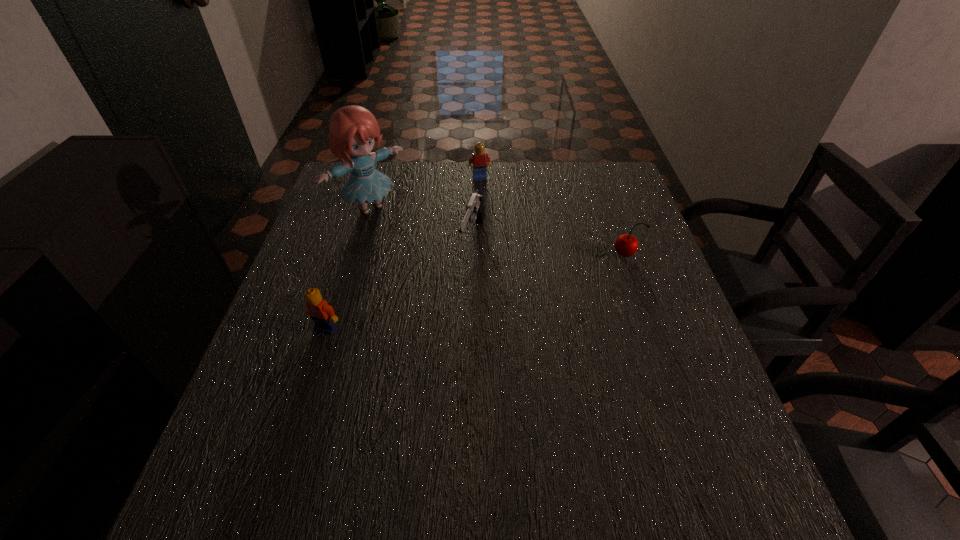
Find the location of a particular element. the nearer Lego is located at coordinates tap(323, 315).

Image resolution: width=960 pixels, height=540 pixels. Identify the location of the left Lego. (323, 315).

Where is `the rightmost object`? the rightmost object is located at coordinates (626, 245).

Identify the location of the right Lego. This screenshot has width=960, height=540. (480, 160).

Locate an element on the screen. The width and height of the screenshot is (960, 540). the farther Lego is located at coordinates coord(480,160).

Identify the location of gun. (475, 210).

What are the coordinates of `doll` in the screenshot? It's located at (353, 130).

Locate an element on the screen. The image size is (960, 540). vacant area situated on the front-facing side of the nearer Lego is located at coordinates (295, 428).

Locate an element on the screen. The height and width of the screenshot is (540, 960). vacant space located on the left of the rightmost object is located at coordinates (516, 255).

This screenshot has height=540, width=960. I want to click on vacant space located 0.260m on the front-facing side of the right Lego, so click(495, 233).